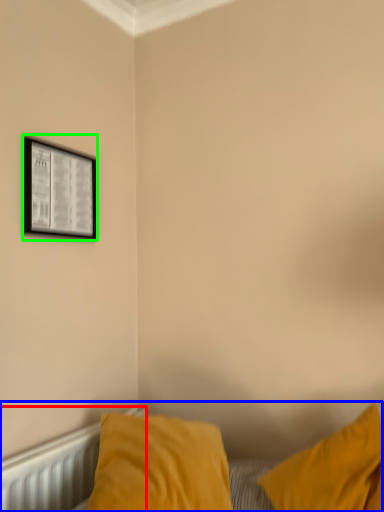
Question: Considering the real-world distances, which object is closest to radiator (highlighted by a red box)? bed (highlighted by a blue box) or picture frame (highlighted by a green box).

Choices:
 (A) bed
 (B) picture frame

Answer: (A)